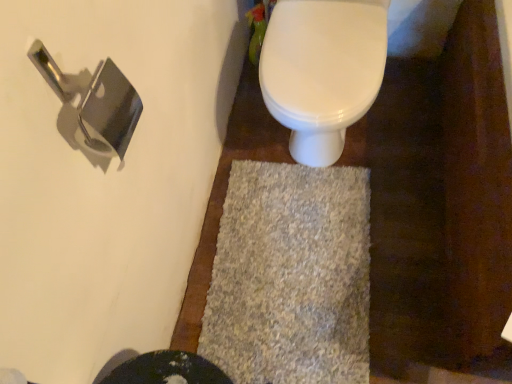
Question: Does polished silver door handle at upper left have a greater height compared to gray shaggy bath mat at center?

Choices:
 (A) yes
 (B) no

Answer: (A)

Question: From the image's perspective, does polished silver door handle at upper left appear higher than gray shaggy bath mat at center?

Choices:
 (A) no
 (B) yes

Answer: (B)

Question: Is polished silver door handle at upper left positioned with its back to gray shaggy bath mat at center?

Choices:
 (A) yes
 (B) no

Answer: (B)

Question: Can you confirm if polished silver door handle at upper left is shorter than gray shaggy bath mat at center?

Choices:
 (A) no
 (B) yes

Answer: (A)

Question: From a real-world perspective, is polished silver door handle at upper left beneath gray shaggy bath mat at center?

Choices:
 (A) yes
 (B) no

Answer: (B)

Question: From a real-world perspective, is polished silver door handle at upper left on gray shaggy bath mat at center?

Choices:
 (A) yes
 (B) no

Answer: (A)

Question: Does white glossy toilet at upper center turn towards polished silver door handle at upper left?

Choices:
 (A) yes
 (B) no

Answer: (B)

Question: Is white glossy toilet at upper center outside of polished silver door handle at upper left?

Choices:
 (A) yes
 (B) no

Answer: (A)

Question: Is white glossy toilet at upper center not near polished silver door handle at upper left?

Choices:
 (A) no
 (B) yes

Answer: (A)

Question: Is white glossy toilet at upper center positioned behind polished silver door handle at upper left?

Choices:
 (A) no
 (B) yes

Answer: (B)

Question: From a real-world perspective, is white glossy toilet at upper center positioned under polished silver door handle at upper left based on gravity?

Choices:
 (A) yes
 (B) no

Answer: (A)

Question: Is white glossy toilet at upper center at the left side of polished silver door handle at upper left?

Choices:
 (A) no
 (B) yes

Answer: (A)

Question: Does white glossy toilet at upper center have a greater width compared to gray shaggy bath mat at center?

Choices:
 (A) no
 (B) yes

Answer: (A)